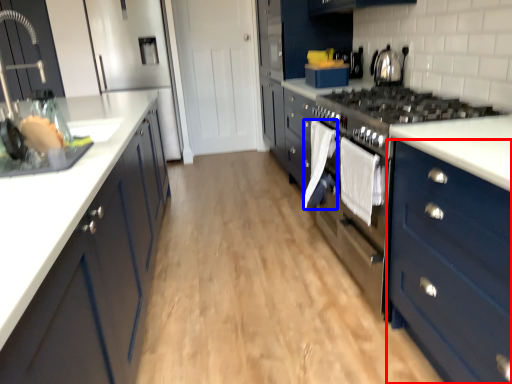
Question: Which point is further to the camera, cabinetry (highlighted by a red box) or clothe (highlighted by a blue box)?

Choices:
 (A) cabinetry
 (B) clothe

Answer: (B)